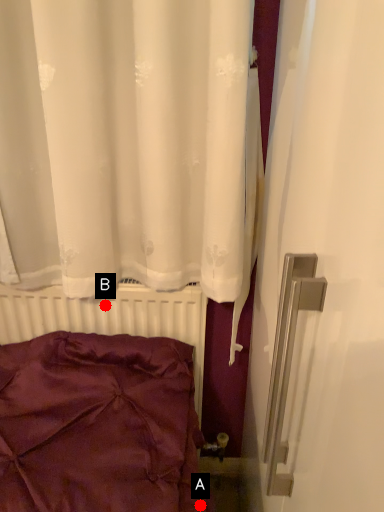
Question: Two points are circled on the image, labeled by A and B beside each circle. Which point is farther to the camera?

Choices:
 (A) A is further
 (B) B is further

Answer: (B)